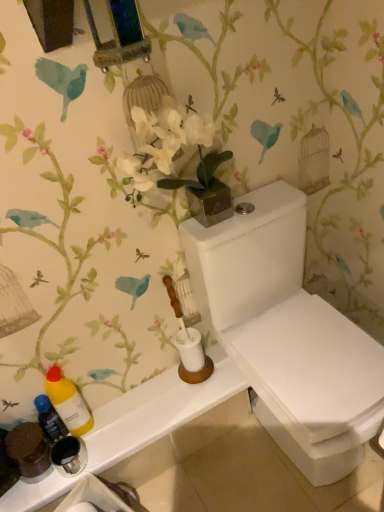
Locate an element on the screen. Image resolution: width=384 pixels, height=512 pixels. vacant area located to the right-hand side of translucent plastic bottle at lower left, which is counted as the second bottle, starting from the right is located at coordinates coord(122,422).